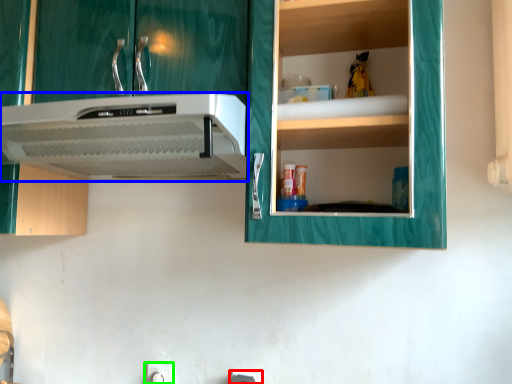
Question: Considering the real-world distances, which object is farthest from electric outlet (highlighted by a red box)? home appliance (highlighted by a blue box) or electric outlet (highlighted by a green box)?

Choices:
 (A) home appliance
 (B) electric outlet

Answer: (A)